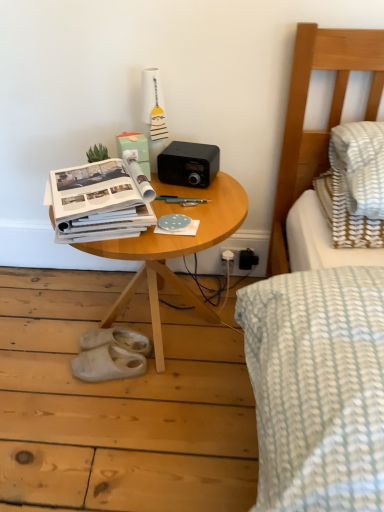
Question: In terms of size, does wooden table at center appear bigger or smaller than white rubber sandals at lower left, the second footwear in the front-to-back sequence?

Choices:
 (A) small
 (B) big

Answer: (B)

Question: Considering the positions of wooden table at center and white rubber sandals at lower left, acting as the first footwear starting from the back, in the image, is wooden table at center wider or thinner than white rubber sandals at lower left, acting as the first footwear starting from the back,?

Choices:
 (A) thin
 (B) wide

Answer: (B)

Question: Which object is the farthest from the wooden table at center?

Choices:
 (A) white rubber sandals at lower left, the second footwear in the front-to-back sequence
 (B) white rubber slippers at lower left, the 1th footwear in the front-to-back sequence
 (C) white paper at center

Answer: (A)

Question: Which object is positioned closest to the wooden table at center?

Choices:
 (A) white rubber sandals at lower left, the second footwear in the front-to-back sequence
 (B) white rubber slippers at lower left, the 1th footwear in the front-to-back sequence
 (C) white paper at center

Answer: (C)